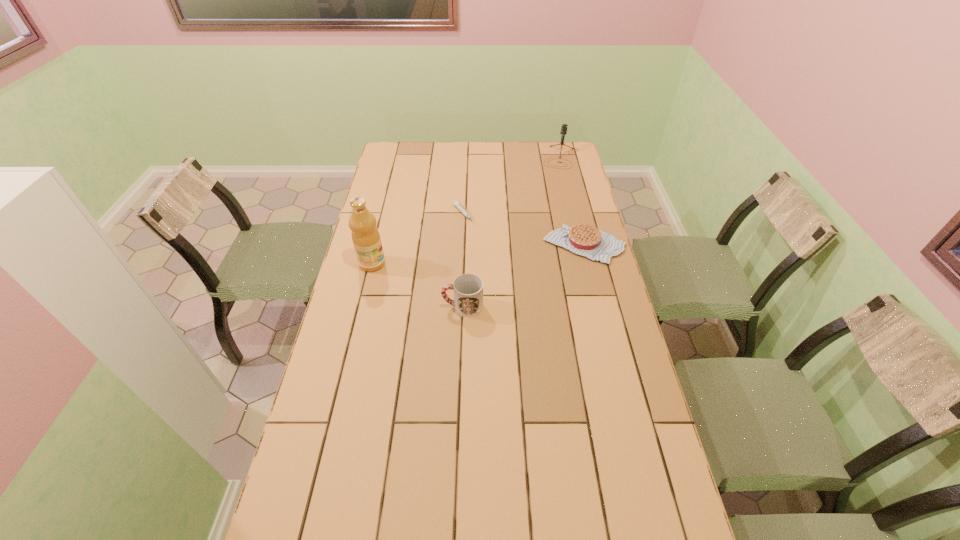
I want to click on free space between the olive oil and the shortest object, so click(419, 239).

Identify the location of free space between the syringe and the cup. (464, 261).

Where is `vacant area between the farthest object and the pie`? Image resolution: width=960 pixels, height=540 pixels. vacant area between the farthest object and the pie is located at coordinates (572, 201).

The height and width of the screenshot is (540, 960). In order to click on vacant area that lies between the pie and the tallest object in this screenshot , I will do `click(478, 254)`.

Locate an element on the screen. This screenshot has width=960, height=540. empty space between the leftmost object and the fourth tallest object is located at coordinates (478, 254).

Locate an element on the screen. The image size is (960, 540). free spot between the second shortest object and the microphone is located at coordinates (572, 201).

Locate an element on the screen. This screenshot has height=540, width=960. vacant area that lies between the shortest object and the microphone is located at coordinates (512, 186).

What are the coordinates of `vacant area that lies between the microphone and the syringe` in the screenshot? It's located at (512, 186).

Locate which object ranks fourth in proximity to the syringe. Please provide its 2D coordinates. Your answer should be formatted as a tuple, i.e. [(x, y)], where the tuple contains the x and y coordinates of a point satisfying the conditions above.

[(564, 126)]

The width and height of the screenshot is (960, 540). Find the location of `the third closest object relative to the second shortest object`. the third closest object relative to the second shortest object is located at coordinates (564, 126).